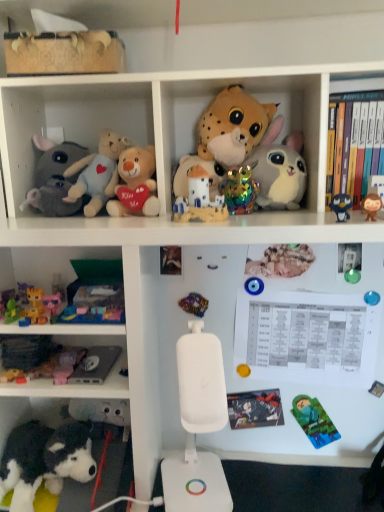
Question: From the image's perspective, is green plastic ball at upper right, which ranks as the second toy in right-to-left order, under hardcover book at upper right, which ranks as the 1th book in right-to-left order?

Choices:
 (A) yes
 (B) no

Answer: (A)

Question: Does green plastic ball at upper right, the 13th toy viewed from the left, have a lesser height compared to hardcover book at upper right, which is the second book in left-to-right order?

Choices:
 (A) yes
 (B) no

Answer: (A)

Question: Is green plastic ball at upper right, which ranks as the second toy in right-to-left order, placed right next to hardcover book at upper right, which is the second book in left-to-right order?

Choices:
 (A) no
 (B) yes

Answer: (A)

Question: From a real-world perspective, is green plastic ball at upper right, the 13th toy viewed from the left, positioned under hardcover book at upper right, which ranks as the 1th book in right-to-left order, based on gravity?

Choices:
 (A) no
 (B) yes

Answer: (B)

Question: Is green plastic ball at upper right, which ranks as the second toy in right-to-left order, taller than hardcover book at upper right, which ranks as the second book in bottom-to-top order?

Choices:
 (A) no
 (B) yes

Answer: (A)

Question: Is black plush dog at lower left, which is counted as the fourth toy, starting from the left, in front of or behind matte ceramic castle at center, the 7th toy when ordered from right to left, in the image?

Choices:
 (A) behind
 (B) front

Answer: (B)

Question: Looking at their shapes, would you say black plush dog at lower left, which is counted as the fourth toy, starting from the left, is wider or thinner than matte ceramic castle at center, which is counted as the eighth toy, starting from the left?

Choices:
 (A) wide
 (B) thin

Answer: (A)

Question: Does point (74, 462) appear closer or farther from the camera than point (193, 185)?

Choices:
 (A) farther
 (B) closer

Answer: (A)

Question: In terms of height, does black plush dog at lower left, which is counted as the fourth toy, starting from the left, look taller or shorter compared to matte ceramic castle at center, which is counted as the eighth toy, starting from the left?

Choices:
 (A) short
 (B) tall

Answer: (B)

Question: From the image's perspective, is matt black comic book at center, placed as the 2th book when sorted from right to left, located above or below multicolored beads at center, which ranks as the eighth toy in right-to-left order?

Choices:
 (A) above
 (B) below

Answer: (B)

Question: Considering the relative positions of matt black comic book at center, placed as the first book when sorted from bottom to top, and multicolored beads at center, the 7th toy positioned from the left, in the image provided, is matt black comic book at center, placed as the first book when sorted from bottom to top, to the left or to the right of multicolored beads at center, the 7th toy positioned from the left,?

Choices:
 (A) right
 (B) left

Answer: (A)

Question: Relative to multicolored beads at center, which ranks as the eighth toy in right-to-left order, is matt black comic book at center, placed as the first book when sorted from bottom to top, in front or behind?

Choices:
 (A) behind
 (B) front

Answer: (A)

Question: Considering the positions of matt black comic book at center, placed as the 1th book when sorted from left to right, and multicolored beads at center, which ranks as the eighth toy in right-to-left order, in the image, is matt black comic book at center, placed as the 1th book when sorted from left to right, bigger or smaller than multicolored beads at center, which ranks as the eighth toy in right-to-left order,?

Choices:
 (A) big
 (B) small

Answer: (A)

Question: Is matte ceramic castle at center, the 7th toy when ordered from right to left, bigger or smaller than white plush rabbit at upper center, the fourth toy positioned from the right?

Choices:
 (A) big
 (B) small

Answer: (B)

Question: Visually, is matte ceramic castle at center, the 7th toy when ordered from right to left, positioned to the left or to the right of white plush rabbit at upper center, arranged as the 11th toy when viewed from the left?

Choices:
 (A) left
 (B) right

Answer: (A)